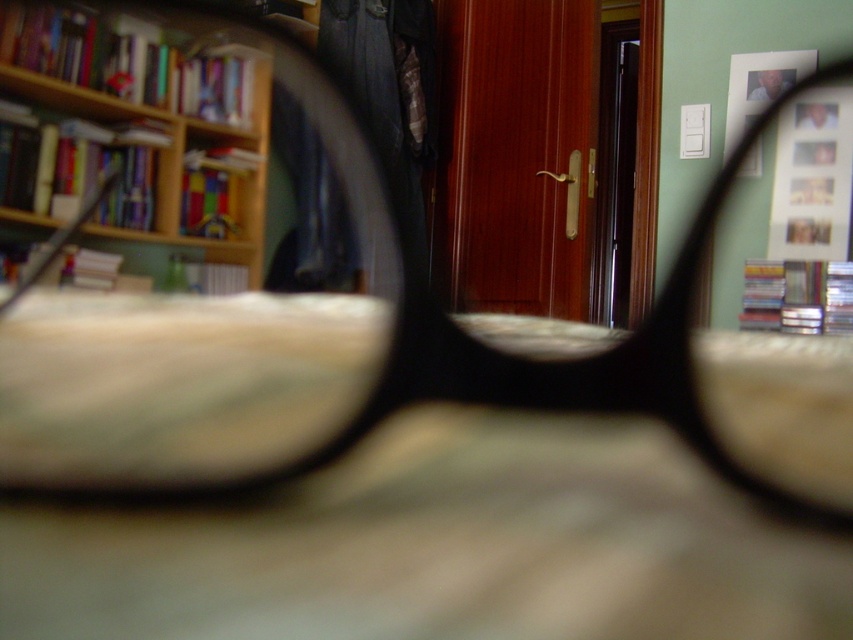
Question: Is transparent plastic magnifying glass at center in front of wooden bookcase at upper left?

Choices:
 (A) yes
 (B) no

Answer: (A)

Question: Which object is farther from the camera taking this photo?

Choices:
 (A) transparent plastic magnifying glass at center
 (B) wooden bookcase at upper left

Answer: (B)

Question: Can you confirm if transparent plastic magnifying glass at center is positioned above matte plastic picture frame at upper right?

Choices:
 (A) no
 (B) yes

Answer: (A)

Question: Considering the relative positions of transparent plastic magnifying glass at center and wooden bookcase at upper left in the image provided, where is transparent plastic magnifying glass at center located with respect to wooden bookcase at upper left?

Choices:
 (A) right
 (B) left

Answer: (A)

Question: Estimate the real-world distances between objects in this image. Which object is farther from the matte plastic picture frame at upper right?

Choices:
 (A) wooden bookcase at upper left
 (B) transparent plastic magnifying glass at center

Answer: (A)

Question: Which point is farther to the camera?

Choices:
 (A) (256, 109)
 (B) (334, 205)

Answer: (B)